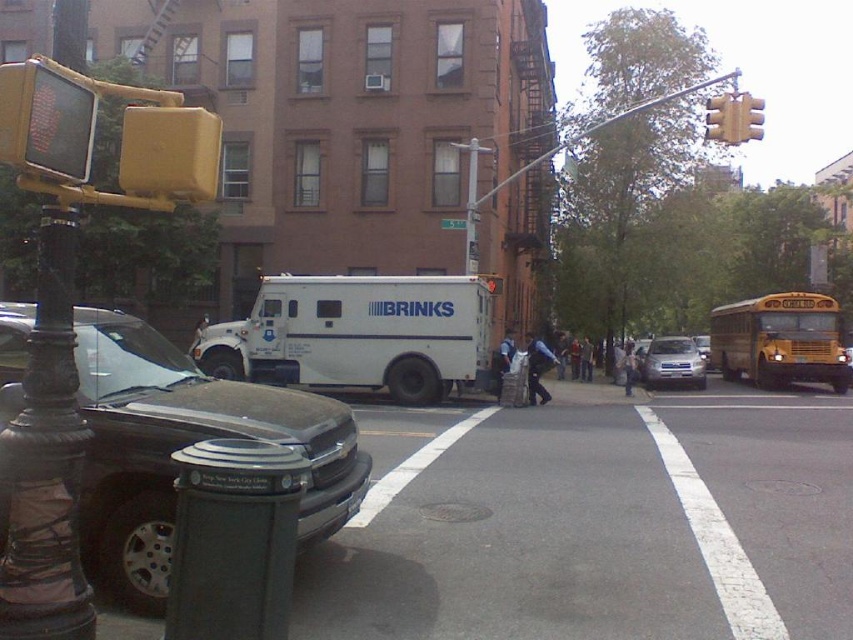
Question: Does metallic gray suv at center-left appear under satin silver sedan at center?

Choices:
 (A) no
 (B) yes

Answer: (B)

Question: Does satin silver sedan at center have a larger size compared to yellow plastic traffic light at upper right?

Choices:
 (A) yes
 (B) no

Answer: (A)

Question: Which point is closer to the camera?

Choices:
 (A) (807, 340)
 (B) (260, 429)

Answer: (B)

Question: Considering the real-world distances, which object is closest to the yellow metallic school bus at right?

Choices:
 (A) yellow plastic traffic light at upper right
 (B) satin silver sedan at center
 (C) white matte armored vehicle at center
 (D) metallic gray suv at center-left

Answer: (B)

Question: Is satin silver sedan at center to the right of yellow plastic traffic light at upper right from the viewer's perspective?

Choices:
 (A) no
 (B) yes

Answer: (B)

Question: Among these objects, which one is nearest to the camera?

Choices:
 (A) yellow metallic school bus at right
 (B) metallic gray suv at center-left
 (C) satin silver sedan at center

Answer: (B)